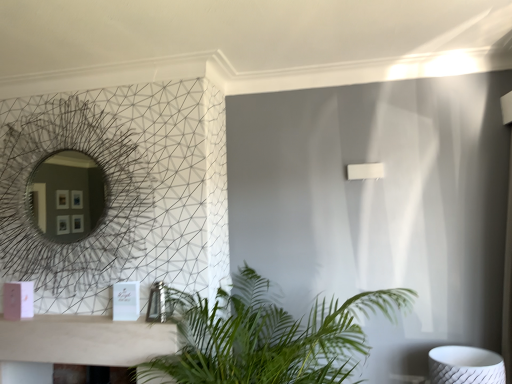
Question: Is there a large distance between metallic wire mesh mirror at upper left and green leafy plant at lower center?

Choices:
 (A) yes
 (B) no

Answer: (B)

Question: Is metallic wire mesh mirror at upper left directly adjacent to green leafy plant at lower center?

Choices:
 (A) no
 (B) yes

Answer: (A)

Question: Considering the relative positions of metallic wire mesh mirror at upper left and green leafy plant at lower center in the image provided, is metallic wire mesh mirror at upper left in front of green leafy plant at lower center?

Choices:
 (A) no
 (B) yes

Answer: (A)

Question: Can you confirm if metallic wire mesh mirror at upper left is thinner than green leafy plant at lower center?

Choices:
 (A) yes
 (B) no

Answer: (A)

Question: From the image's perspective, does metallic wire mesh mirror at upper left appear higher than green leafy plant at lower center?

Choices:
 (A) no
 (B) yes

Answer: (B)

Question: Would you say metallic wire mesh mirror at upper left contains green leafy plant at lower center?

Choices:
 (A) yes
 (B) no

Answer: (B)

Question: Is green leafy plant at lower center positioned with its back to metallic wire mesh mirror at upper left?

Choices:
 (A) no
 (B) yes

Answer: (A)

Question: Does green leafy plant at lower center have a smaller size compared to metallic wire mesh mirror at upper left?

Choices:
 (A) yes
 (B) no

Answer: (B)

Question: Can you confirm if green leafy plant at lower center is wider than metallic wire mesh mirror at upper left?

Choices:
 (A) yes
 (B) no

Answer: (A)

Question: Is green leafy plant at lower center not inside metallic wire mesh mirror at upper left?

Choices:
 (A) no
 (B) yes

Answer: (B)

Question: Would you say green leafy plant at lower center contains metallic wire mesh mirror at upper left?

Choices:
 (A) yes
 (B) no

Answer: (B)

Question: Are green leafy plant at lower center and metallic wire mesh mirror at upper left located far from each other?

Choices:
 (A) no
 (B) yes

Answer: (A)

Question: From the image's perspective, is green leafy plant at lower center positioned above or below metallic wire mesh mirror at upper left?

Choices:
 (A) above
 (B) below

Answer: (B)